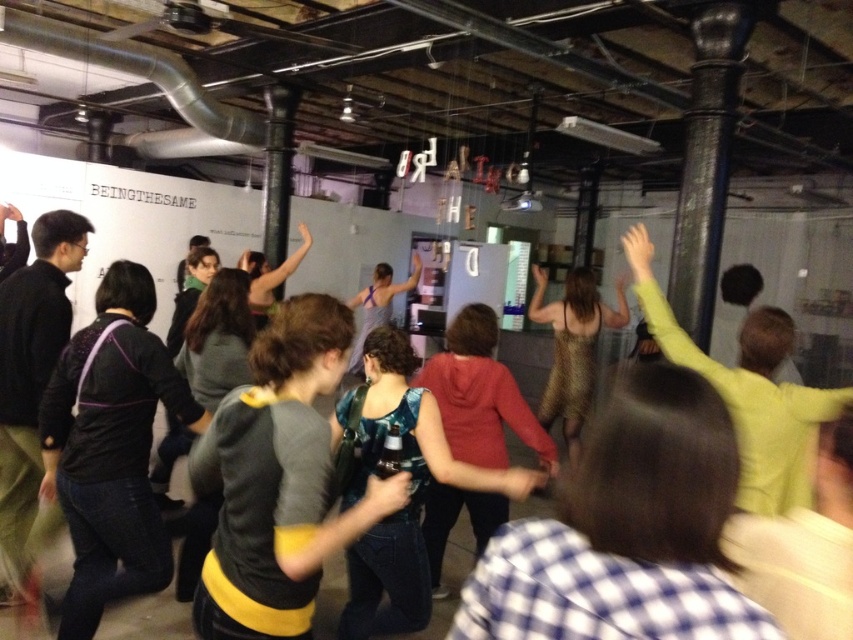
Question: From the image, what is the correct spatial relationship of dark gray sweater at center in relation to matte black jacket at center?

Choices:
 (A) right
 (B) left

Answer: (B)

Question: Is black matte jacket at left positioned at the back of gold sequined dress at center?

Choices:
 (A) no
 (B) yes

Answer: (A)

Question: Which point appears farthest from the camera in this image?

Choices:
 (A) (697, 451)
 (B) (779, 429)
 (C) (473, 356)

Answer: (C)

Question: Does light green sweater at upper right appear on the right side of matte gray tank top at center?

Choices:
 (A) no
 (B) yes

Answer: (B)

Question: Which object is positioned farthest from the checkered shirt at center?

Choices:
 (A) matte gray tank top at center
 (B) light green sweater at upper right

Answer: (A)

Question: Which of these objects is positioned closest to the black matte jacket at left?

Choices:
 (A) light green sweater at upper right
 (B) dark gray sweater at center

Answer: (B)